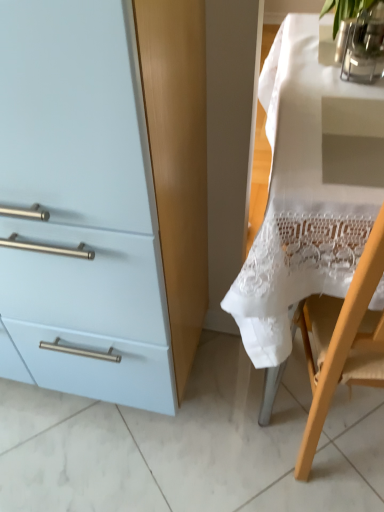
I want to click on free space to the back side of clear glass vase at upper right, the second glass vase positioned from the back, so click(308, 48).